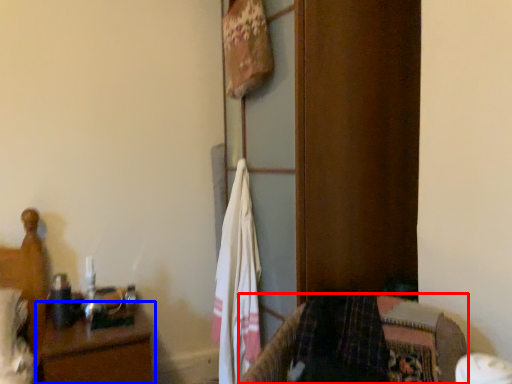
Question: Which point is further to the camera, furniture (highlighted by a red box) or nightstand (highlighted by a blue box)?

Choices:
 (A) furniture
 (B) nightstand

Answer: (B)